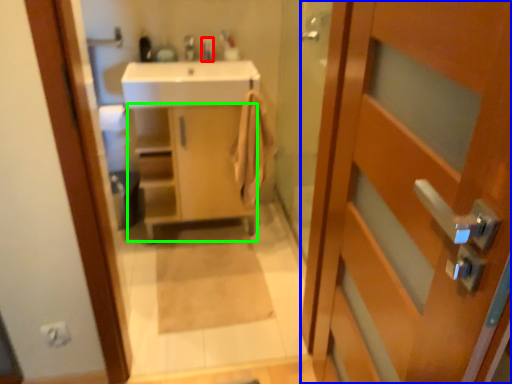
Question: Which is nearer to the toiletry (highlighted by a red box)? door (highlighted by a blue box) or cabinetry (highlighted by a green box).

Choices:
 (A) door
 (B) cabinetry

Answer: (B)